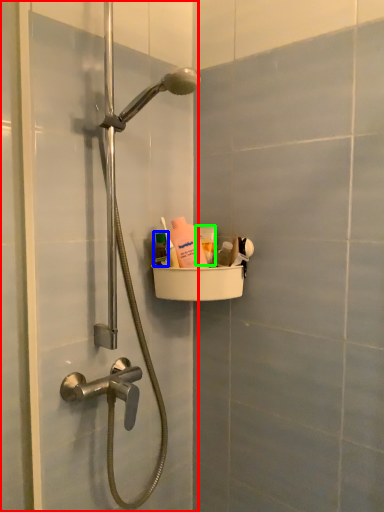
Question: Estimate the real-world distances between objects in this image. Which object is closer to screen door (highlighted by a red box), mouthwash (highlighted by a blue box) or mouthwash (highlighted by a green box)?

Choices:
 (A) mouthwash
 (B) mouthwash

Answer: (A)